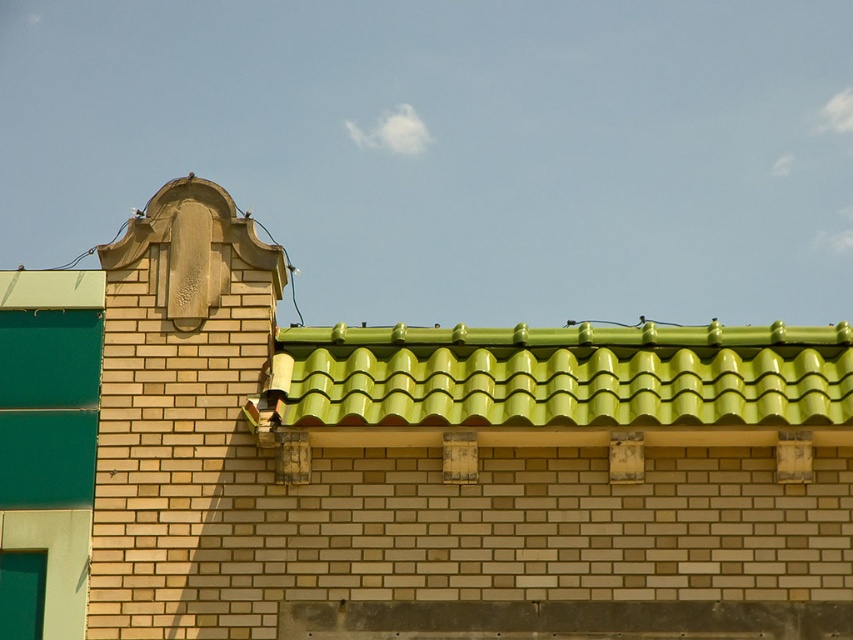
Question: Can you confirm if green glazed tiles at upper center is positioned above green glossy tiles at upper center?

Choices:
 (A) yes
 (B) no

Answer: (B)

Question: Among these points, which one is farthest from the camera?

Choices:
 (A) (837, 376)
 (B) (378, 358)

Answer: (B)

Question: Among these objects, which one is nearest to the camera?

Choices:
 (A) green glossy tiles at upper center
 (B) green glazed tiles at upper center

Answer: (B)

Question: From the image, what is the correct spatial relationship of green glazed tiles at upper center in relation to green glossy tiles at upper center?

Choices:
 (A) below
 (B) above

Answer: (A)

Question: Does green glazed tiles at upper center have a lesser width compared to green glossy tiles at upper center?

Choices:
 (A) yes
 (B) no

Answer: (B)